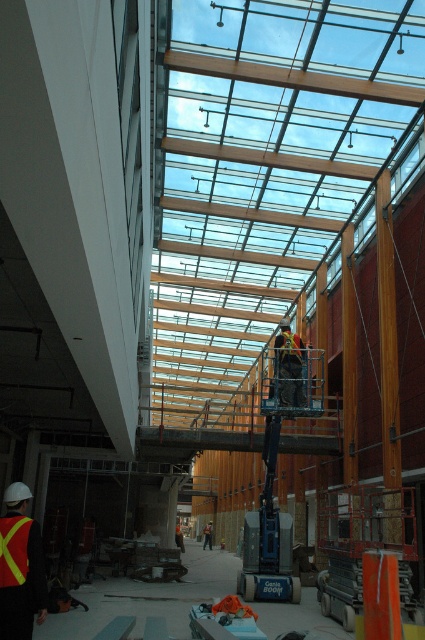
You are a safety inspector evaluating the construction site. You notice two safety vests in the lower left corner of the image. Which one is taller between the reflective safety vest at lower left and the yellow reflective fabric safety vest at lower left?

The reflective safety vest at lower left is much taller than the yellow reflective fabric safety vest at lower left.

You are a safety inspector standing at the center of the atrium. You notice two points marked in the construction plans. The first point is at coordinates point (305, 397) and the second is at point (289, 355). According to the construction plans, which point is closer to you?

Point (305, 397) is in front of point (289, 355), so it is closer to you.